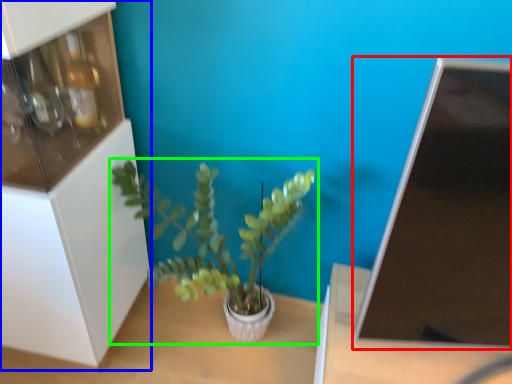
Question: Estimate the real-world distances between objects in this image. Which object is closer to computer monitor (highlighted by a red box), shelf (highlighted by a blue box) or houseplant (highlighted by a green box)?

Choices:
 (A) shelf
 (B) houseplant

Answer: (B)